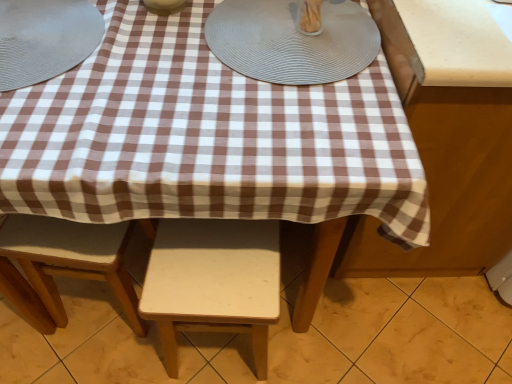
Describe the element at coordinates (164, 6) in the screenshot. I see `matte ceramic bowl at upper center, the second tableware when ordered from right to left` at that location.

Image resolution: width=512 pixels, height=384 pixels. Describe the element at coordinates (71, 259) in the screenshot. I see `light wood stool at lower center, the 1th stool positioned from the left` at that location.

Describe the element at coordinates (45, 39) in the screenshot. I see `matte gray placemat at upper left, which ranks as the first tableware in left-to-right order` at that location.

In order to click on brown checkered tablecloth at right in this screenshot , I will do `click(446, 139)`.

Is clear glass container at upper center, which is counted as the 3th tableware, starting from the left, smaller than matte gray placemat at upper left, which ranks as the first tableware in left-to-right order?

Yes.

Is point (314, 1) more distant than point (7, 52)?

Yes, point (314, 1) is behind point (7, 52).

Looking at this image, is clear glass container at upper center, which is counted as the 3th tableware, starting from the left, far away from matte gray placemat at upper left, which is the 3th tableware in right-to-left order?

No.

In the scene shown: From the image's perspective, is clear glass container at upper center, placed as the first tableware when sorted from right to left, positioned above or below matte gray placemat at upper left, which is the 3th tableware in right-to-left order?

Based on their image positions, clear glass container at upper center, placed as the first tableware when sorted from right to left, is located above matte gray placemat at upper left, which is the 3th tableware in right-to-left order.

Considering the positions of point (77, 21) and point (172, 2), is point (77, 21) closer or farther from the camera than point (172, 2)?

Point (77, 21).

Is matte gray placemat at upper left, which ranks as the first tableware in left-to-right order, not inside matte ceramic bowl at upper center, which ranks as the 2th tableware in left-to-right order?

Indeed, matte gray placemat at upper left, which ranks as the first tableware in left-to-right order, is completely outside matte ceramic bowl at upper center, which ranks as the 2th tableware in left-to-right order.

Can you tell me how much matte gray placemat at upper left, which is the 3th tableware in right-to-left order, and matte ceramic bowl at upper center, the second tableware when ordered from right to left, differ in facing direction?

0.00281 degrees.

Is matte gray placemat at upper left, which ranks as the first tableware in left-to-right order, far away from matte ceramic bowl at upper center, the second tableware when ordered from right to left?

matte gray placemat at upper left, which ranks as the first tableware in left-to-right order, is actually quite close to matte ceramic bowl at upper center, the second tableware when ordered from right to left.

Considering the relative sizes of gray textured placemat at upper center and matte gray placemat at upper left, which ranks as the first tableware in left-to-right order, in the image provided, is gray textured placemat at upper center bigger than matte gray placemat at upper left, which ranks as the first tableware in left-to-right order,?

Incorrect, gray textured placemat at upper center is not larger than matte gray placemat at upper left, which ranks as the first tableware in left-to-right order.

Which tableware is the 2nd one when counting from the left side of the gray textured placemat at upper center? Please provide its 2D coordinates.

[(45, 39)]

Which object is positioned more to the right, gray textured placemat at upper center or matte gray placemat at upper left, which is the 3th tableware in right-to-left order?

gray textured placemat at upper center.

The width and height of the screenshot is (512, 384). Find the location of `the 1st tableware counting from the left of the brown checkered tablecloth at right`. the 1st tableware counting from the left of the brown checkered tablecloth at right is located at coordinates (309, 17).

Considering the points (297, 15) and (445, 15), which point is behind, point (297, 15) or point (445, 15)?

The point (297, 15) is farther.

From the image's perspective, which one is positioned higher, clear glass container at upper center, which is counted as the 3th tableware, starting from the left, or brown checkered tablecloth at right?

clear glass container at upper center, which is counted as the 3th tableware, starting from the left, is shown above in the image.

Looking at this image, considering their positions, is clear glass container at upper center, which is counted as the 3th tableware, starting from the left, located in front of or behind brown checkered tablecloth at right?

Clearly, clear glass container at upper center, which is counted as the 3th tableware, starting from the left, is behind brown checkered tablecloth at right.

Which object is positioned more to the left, matte ceramic bowl at upper center, the second tableware when ordered from right to left, or light wood stool at lower center, the 1th stool positioned from the left?

light wood stool at lower center, the 1th stool positioned from the left.

Can you confirm if matte ceramic bowl at upper center, which ranks as the 2th tableware in left-to-right order, is thinner than light wood stool at lower center, placed as the 2th stool when sorted from right to left?

Yes.

Would you say matte ceramic bowl at upper center, the second tableware when ordered from right to left, is inside or outside light wood stool at lower center, placed as the 2th stool when sorted from right to left?

matte ceramic bowl at upper center, the second tableware when ordered from right to left, cannot be found inside light wood stool at lower center, placed as the 2th stool when sorted from right to left.

Is matte ceramic bowl at upper center, which ranks as the 2th tableware in left-to-right order, positioned far away from light wood stool at lower center, placed as the 2th stool when sorted from right to left?

No, there isn't a large distance between matte ceramic bowl at upper center, which ranks as the 2th tableware in left-to-right order, and light wood stool at lower center, placed as the 2th stool when sorted from right to left.

Is matte ceramic bowl at upper center, which ranks as the 2th tableware in left-to-right order, shorter than white matte stool at center, which ranks as the 2th stool in left-to-right order?

Yes.

In order to click on tableware that is the 3rd object located in front of the white matte stool at center, which ranks as the 2th stool in left-to-right order in this screenshot , I will do `click(164, 6)`.

From a real-world perspective, between matte ceramic bowl at upper center, the second tableware when ordered from right to left, and white matte stool at center, arranged as the first stool when viewed from the right, who is vertically lower?

white matte stool at center, arranged as the first stool when viewed from the right, from a real-world perspective.

Is matte ceramic bowl at upper center, the second tableware when ordered from right to left, looking in the opposite direction of white matte stool at center, which ranks as the 2th stool in left-to-right order?

No, matte ceramic bowl at upper center, the second tableware when ordered from right to left, is not facing the opposite direction of white matte stool at center, which ranks as the 2th stool in left-to-right order.

From a real-world perspective, is gray textured placemat at upper center positioned above or below light wood stool at lower center, the 1th stool positioned from the left?

From a real-world perspective, gray textured placemat at upper center is physically above light wood stool at lower center, the 1th stool positioned from the left.

Is gray textured placemat at upper center spatially inside light wood stool at lower center, the 1th stool positioned from the left, or outside of it?

The correct answer is: outside.

Can you confirm if gray textured placemat at upper center is thinner than light wood stool at lower center, placed as the 2th stool when sorted from right to left?

In fact, gray textured placemat at upper center might be wider than light wood stool at lower center, placed as the 2th stool when sorted from right to left.

Find the location of `tableware that is the 2nd one when counting rightward from the matte gray placemat at upper left, which ranks as the first tableware in left-to-right order`. tableware that is the 2nd one when counting rightward from the matte gray placemat at upper left, which ranks as the first tableware in left-to-right order is located at coordinates (309, 17).

This screenshot has width=512, height=384. Identify the location of the 2nd tableware below the matte ceramic bowl at upper center, which ranks as the 2th tableware in left-to-right order (from the image's perspective). (45, 39).

Based on their spatial positions, is light wood stool at lower center, the 1th stool positioned from the left, or matte gray placemat at upper left, which ranks as the first tableware in left-to-right order, further from clear glass container at upper center, placed as the first tableware when sorted from right to left?

The object further to clear glass container at upper center, placed as the first tableware when sorted from right to left, is light wood stool at lower center, the 1th stool positioned from the left.

Estimate the real-world distances between objects in this image. Which object is closer to white matte stool at center, arranged as the first stool when viewed from the right, matte gray placemat at upper left, which is the 3th tableware in right-to-left order, or matte ceramic bowl at upper center, the second tableware when ordered from right to left?

matte gray placemat at upper left, which is the 3th tableware in right-to-left order, lies closer to white matte stool at center, arranged as the first stool when viewed from the right, than the other object.

Considering their positions, is light wood stool at lower center, placed as the 2th stool when sorted from right to left, positioned closer to brown checkered tablecloth at right than matte gray placemat at upper left, which is the 3th tableware in right-to-left order?

light wood stool at lower center, placed as the 2th stool when sorted from right to left.

From the image, which object appears to be nearer to matte ceramic bowl at upper center, the second tableware when ordered from right to left, clear glass container at upper center, placed as the first tableware when sorted from right to left, or matte gray placemat at upper left, which ranks as the first tableware in left-to-right order?

matte gray placemat at upper left, which ranks as the first tableware in left-to-right order, lies closer to matte ceramic bowl at upper center, the second tableware when ordered from right to left, than the other object.

Considering their positions, is matte ceramic bowl at upper center, the second tableware when ordered from right to left, positioned further to light wood stool at lower center, placed as the 2th stool when sorted from right to left, than white matte stool at center, which ranks as the 2th stool in left-to-right order?

Based on the image, matte ceramic bowl at upper center, the second tableware when ordered from right to left, appears to be further to light wood stool at lower center, placed as the 2th stool when sorted from right to left.

Based on the photo, from the image, which object appears to be farther from white matte stool at center, arranged as the first stool when viewed from the right, brown checkered tablecloth at right or clear glass container at upper center, which is counted as the 3th tableware, starting from the left?

clear glass container at upper center, which is counted as the 3th tableware, starting from the left, is positioned further to the anchor white matte stool at center, arranged as the first stool when viewed from the right.

Considering their positions, is matte ceramic bowl at upper center, the second tableware when ordered from right to left, positioned further to brown checkered tablecloth at right than light wood stool at lower center, placed as the 2th stool when sorted from right to left?

light wood stool at lower center, placed as the 2th stool when sorted from right to left, is further to brown checkered tablecloth at right.

From the image, which object appears to be farther from light wood stool at lower center, placed as the 2th stool when sorted from right to left, white matte stool at center, which ranks as the 2th stool in left-to-right order, or clear glass container at upper center, placed as the first tableware when sorted from right to left?

clear glass container at upper center, placed as the first tableware when sorted from right to left, lies further to light wood stool at lower center, placed as the 2th stool when sorted from right to left, than the other object.

Find the location of `tableware between matte gray placemat at upper left, which ranks as the first tableware in left-to-right order, and clear glass container at upper center, placed as the first tableware when sorted from right to left, in the horizontal direction`. tableware between matte gray placemat at upper left, which ranks as the first tableware in left-to-right order, and clear glass container at upper center, placed as the first tableware when sorted from right to left, in the horizontal direction is located at coordinates (164, 6).

The height and width of the screenshot is (384, 512). I want to click on stool between matte gray placemat at upper left, which is the 3th tableware in right-to-left order, and white matte stool at center, which ranks as the 2th stool in left-to-right order, in the vertical direction, so click(71, 259).

This screenshot has width=512, height=384. Find the location of `table that lies between clear glass container at upper center, which is counted as the 3th tableware, starting from the left, and white matte stool at center, arranged as the first stool when viewed from the right, from top to bottom`. table that lies between clear glass container at upper center, which is counted as the 3th tableware, starting from the left, and white matte stool at center, arranged as the first stool when viewed from the right, from top to bottom is located at coordinates (446, 139).

You are a GUI agent. You are given a task and a screenshot of the screen. Output one action in this format:
    pyautogui.click(x=<x>, y=<y>)
    Task: Click on the platter between clear glass container at upper center, placed as the first tableware when sorted from right to left, and white matte stool at center, which ranks as the 2th stool in left-to-right order, vertically
    This screenshot has height=384, width=512.
    Given the screenshot: What is the action you would take?
    pyautogui.click(x=291, y=41)